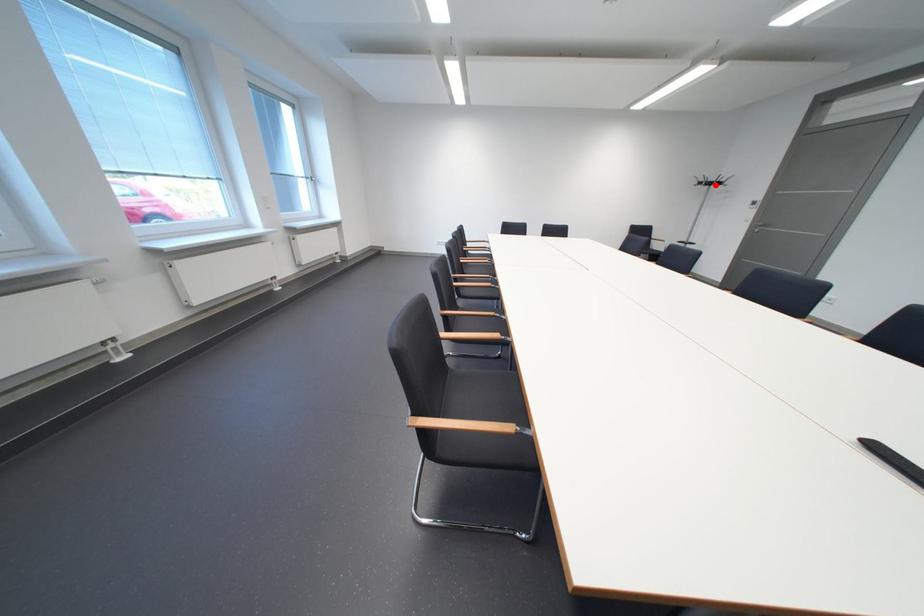
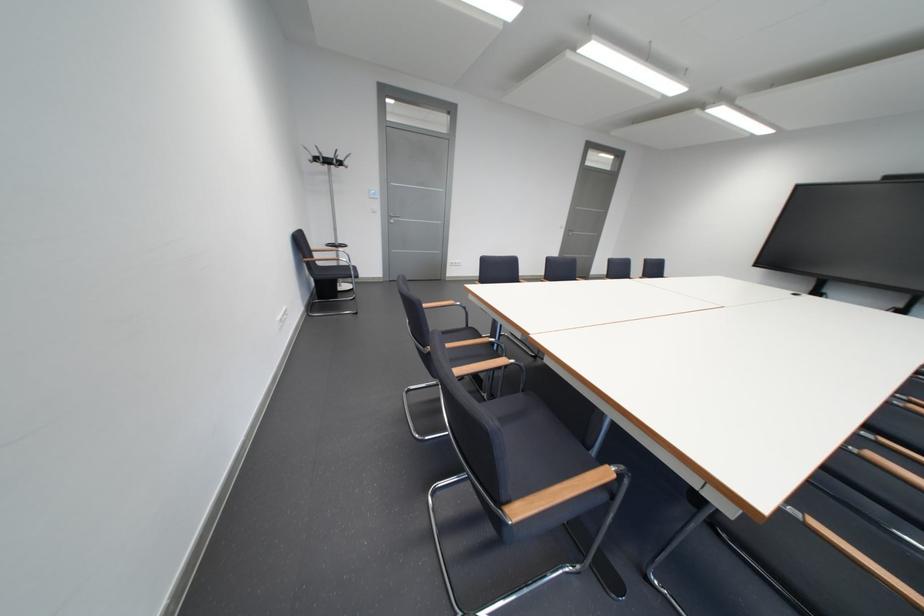
The point at the highlighted location is marked in the first image. Where is the corresponding point in the second image?

(330, 161)